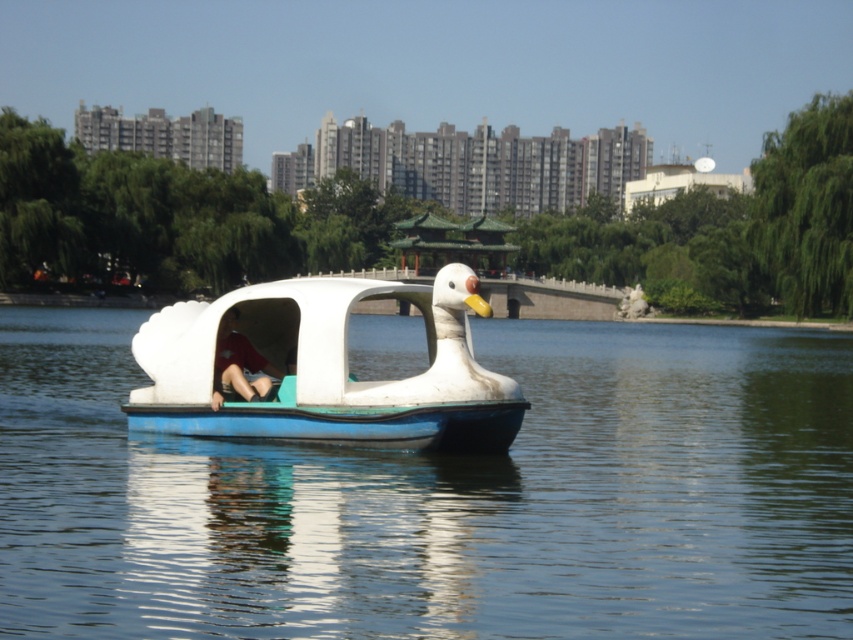
This screenshot has width=853, height=640. What do you see at coordinates (440, 497) in the screenshot? I see `transparent blue water at center` at bounding box center [440, 497].

Can you confirm if transparent blue water at center is wider than white matte duck boat at center?

Yes.

Is point (219, 506) behind point (292, 278)?

No, (219, 506) is in front of (292, 278).

The width and height of the screenshot is (853, 640). I want to click on transparent blue water at center, so click(x=440, y=497).

Is white matte duck boat at center wider than matte red shirt at center?

Correct, the width of white matte duck boat at center exceeds that of matte red shirt at center.

You are a GUI agent. You are given a task and a screenshot of the screen. Output one action in this format:
    pyautogui.click(x=<x>, y=<y>)
    Task: Click on the white matte duck boat at center
    
    Given the screenshot: What is the action you would take?
    pyautogui.click(x=325, y=369)

Locate an element on the screen. white matte duck boat at center is located at coordinates (325, 369).

Can you confirm if transparent blue water at center is thinner than matte red shirt at center?

Incorrect, transparent blue water at center's width is not less than matte red shirt at center's.

Looking at this image, does transparent blue water at center appear over matte red shirt at center?

Yes, transparent blue water at center is above matte red shirt at center.

This screenshot has width=853, height=640. I want to click on transparent blue water at center, so click(x=440, y=497).